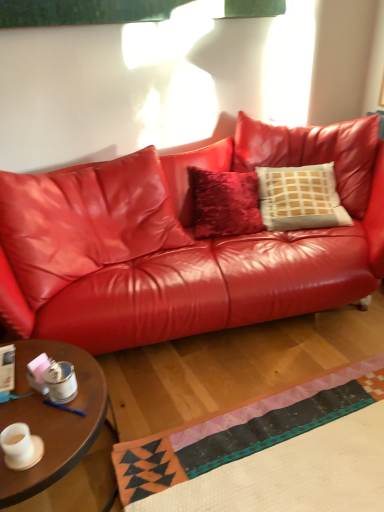
At what (x,y) coordinates should I click in order to perform the action: click on free space on the front side of matte white cup at lower left. Please return your answer as a coordinate pair (x, y). The height and width of the screenshot is (512, 384). Looking at the image, I should click on (20, 478).